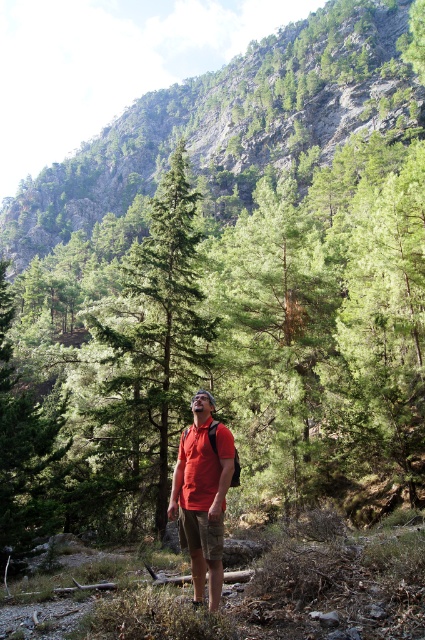
Question: Is green matte tree at center above matte red shirt at center?

Choices:
 (A) no
 (B) yes

Answer: (B)

Question: Can you confirm if green matte tree at center is wider than matte red shirt at center?

Choices:
 (A) no
 (B) yes

Answer: (B)

Question: Which object is farther from the camera taking this photo?

Choices:
 (A) green matte tree at center
 (B) matte red shirt at center

Answer: (A)

Question: Is green matte tree at center positioned before matte red shirt at center?

Choices:
 (A) no
 (B) yes

Answer: (A)

Question: Which object appears farthest from the camera in this image?

Choices:
 (A) green matte tree at center
 (B) matte red shirt at center

Answer: (A)